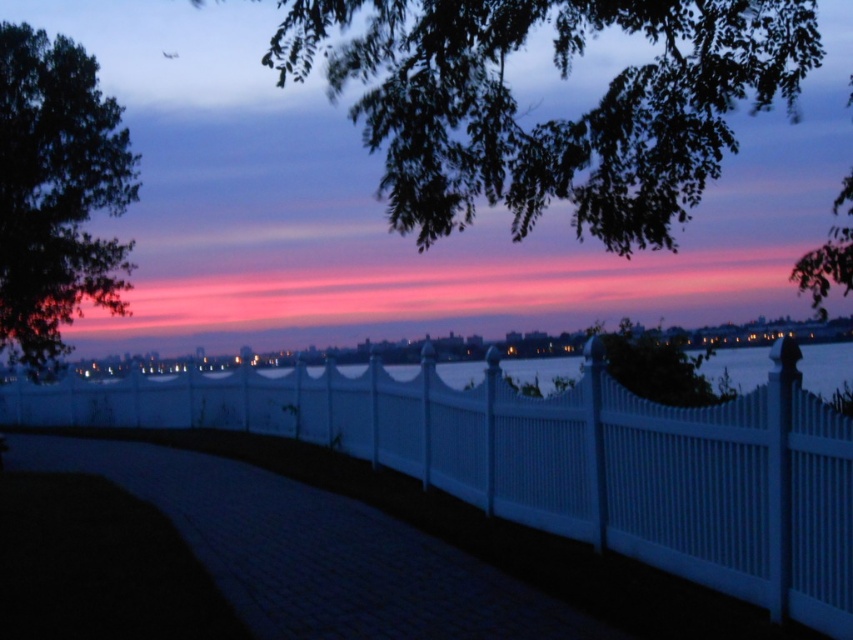
Between white vinyl fence at center and green leafy branches at upper center, which one has less height?

Standing shorter between the two is white vinyl fence at center.

Which of these two, white vinyl fence at center or green leafy branches at upper center, stands taller?

Standing taller between the two is green leafy branches at upper center.

You are a GUI agent. You are given a task and a screenshot of the screen. Output one action in this format:
    pyautogui.click(x=<x>, y=<y>)
    Task: Click on the white vinyl fence at center
    Image resolution: width=853 pixels, height=640 pixels.
    Given the screenshot: What is the action you would take?
    pyautogui.click(x=556, y=460)

Is green leafy branches at upper center to the right of dark green leafy tree at upper left from the viewer's perspective?

Correct, you'll find green leafy branches at upper center to the right of dark green leafy tree at upper left.

At what (x,y) coordinates should I click in order to perform the action: click on green leafy branches at upper center. Please return your answer as a coordinate pair (x, y). The image size is (853, 640). Looking at the image, I should click on (550, 120).

Describe the element at coordinates (550, 120) in the screenshot. This screenshot has width=853, height=640. I see `green leafy branches at upper center` at that location.

Image resolution: width=853 pixels, height=640 pixels. Find the location of `green leafy branches at upper center`. green leafy branches at upper center is located at coordinates (550, 120).

Who is taller, white vinyl fence at center or dark green leafy tree at upper left?

With more height is dark green leafy tree at upper left.

Between point (643, 529) and point (50, 285), which one is positioned in front?

Point (643, 529) is more forward.

Locate an element on the screen. This screenshot has height=640, width=853. white vinyl fence at center is located at coordinates (556, 460).